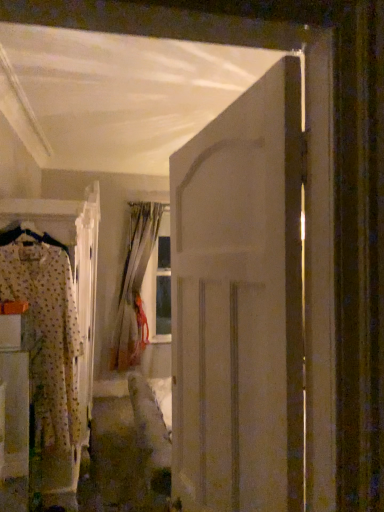
At what (x,y) coordinates should I click in order to perform the action: click on silky beige curtain at center. Please return your answer as a coordinate pair (x, y). Image resolution: width=384 pixels, height=512 pixels. Looking at the image, I should click on (x=134, y=287).

What do you see at coordinates (48, 348) in the screenshot? The image size is (384, 512). I see `patterned fabric pajamas at left` at bounding box center [48, 348].

Where is `fluffy fabric pajama set at left`? This screenshot has width=384, height=512. fluffy fabric pajama set at left is located at coordinates (14, 415).

Identify the location of silky beige curtain at center. click(134, 287).

From the image's perspective, who appears lower, patterned fabric pajamas at left or silky beige curtain at center?

patterned fabric pajamas at left is shown below in the image.

Considering the relative sizes of patterned fabric pajamas at left and silky beige curtain at center in the image provided, is patterned fabric pajamas at left taller than silky beige curtain at center?

No, patterned fabric pajamas at left is not taller than silky beige curtain at center.

From a real-world perspective, does patterned fabric pajamas at left stand above silky beige curtain at center?

No, from a real-world perspective, patterned fabric pajamas at left is not on top of silky beige curtain at center.

Is silky beige curtain at center a part of patterned fabric pajamas at left?

No, silky beige curtain at center is located outside of patterned fabric pajamas at left.

What's the angular difference between white matte door at center and fluffy fabric pajama set at left's facing directions?

They differ by 173 degrees in their facing directions.

Is white matte door at center further to the viewer compared to fluffy fabric pajama set at left?

No, it is in front of fluffy fabric pajama set at left.

From a real-world perspective, between white matte door at center and fluffy fabric pajama set at left, who is vertically higher?

In real-world perspective, white matte door at center is above.

Does white matte door at center have a smaller size compared to fluffy fabric pajama set at left?

Yes, white matte door at center is smaller than fluffy fabric pajama set at left.

Between silky beige curtain at center and patterned fabric pajamas at left, which one appears on the left side from the viewer's perspective?

patterned fabric pajamas at left is more to the left.

Does silky beige curtain at center turn towards patterned fabric pajamas at left?

Yes, silky beige curtain at center is turned towards patterned fabric pajamas at left.

The width and height of the screenshot is (384, 512). Identify the location of clothing that appears below the silky beige curtain at center (from the image's perspective). (48, 348).

Is point (148, 231) positioned after point (51, 291)?

That is True.

Is fluffy fabric pajama set at left next to white matte door at center?

No, fluffy fabric pajama set at left is not in contact with white matte door at center.

From their relative heights in the image, would you say fluffy fabric pajama set at left is taller or shorter than white matte door at center?

In the image, fluffy fabric pajama set at left appears to be shorter than white matte door at center.

Considering the positions of point (11, 361) and point (280, 286), is point (11, 361) closer or farther from the camera than point (280, 286)?

Clearly, point (11, 361) is more distant from the camera than point (280, 286).

Locate an element on the screen. furniture located below the white matte door at center (from the image's perspective) is located at coordinates (14, 415).

Looking at this image, is white matte door at center taller or shorter than patterned fabric pajamas at left?

Clearly, white matte door at center is shorter compared to patterned fabric pajamas at left.

From a real-world perspective, which object stands above the other?

In real-world perspective, white matte door at center is above.

From the image's perspective, is white matte door at center beneath patterned fabric pajamas at left?

Actually, white matte door at center appears above patterned fabric pajamas at left in the image.

Which is in front, point (223, 382) or point (48, 441)?

The point (223, 382) is more forward.

Is silky beige curtain at center beside fluffy fabric pajama set at left?

No, silky beige curtain at center is not beside fluffy fabric pajama set at left.

Can you confirm if silky beige curtain at center is smaller than fluffy fabric pajama set at left?

Incorrect, silky beige curtain at center is not smaller in size than fluffy fabric pajama set at left.

Between silky beige curtain at center and fluffy fabric pajama set at left, which one has more height?

silky beige curtain at center.

Between fluffy fabric pajama set at left and patterned fabric pajamas at left, which one has larger width?

fluffy fabric pajama set at left is wider.

From the picture: Is fluffy fabric pajama set at left outside of patterned fabric pajamas at left?

fluffy fabric pajama set at left lies outside patterned fabric pajamas at left's area.

Considering the relative sizes of fluffy fabric pajama set at left and patterned fabric pajamas at left in the image provided, is fluffy fabric pajama set at left bigger than patterned fabric pajamas at left?

Yes.

I want to click on clothing on the right of fluffy fabric pajama set at left, so click(48, 348).

Locate an element on the screen. This screenshot has height=512, width=384. curtain behind the patterned fabric pajamas at left is located at coordinates (134, 287).

Identify the location of door lying on the right of fluffy fabric pajama set at left. click(x=239, y=304).

Based on their spatial positions, is silky beige curtain at center or patterned fabric pajamas at left further from white matte door at center?

silky beige curtain at center is positioned further to the anchor white matte door at center.

When comparing their distances from patterned fabric pajamas at left, does white matte door at center or fluffy fabric pajama set at left seem further?

white matte door at center lies further to patterned fabric pajamas at left than the other object.

Which object lies nearer to the anchor point fluffy fabric pajama set at left, white matte door at center or patterned fabric pajamas at left?

A: Based on the image, patterned fabric pajamas at left appears to be nearer to fluffy fabric pajama set at left.

Which object lies further to the anchor point fluffy fabric pajama set at left, silky beige curtain at center or patterned fabric pajamas at left?

silky beige curtain at center.

Which object lies further to the anchor point silky beige curtain at center, fluffy fabric pajama set at left or patterned fabric pajamas at left?

patterned fabric pajamas at left.

Estimate the real-world distances between objects in this image. Which object is further from patterned fabric pajamas at left, fluffy fabric pajama set at left or white matte door at center?

Among the two, white matte door at center is located further to patterned fabric pajamas at left.

Which object lies nearer to the anchor point silky beige curtain at center, white matte door at center or fluffy fabric pajama set at left?

fluffy fabric pajama set at left is closer to silky beige curtain at center.

Considering their positions, is fluffy fabric pajama set at left positioned further to white matte door at center than silky beige curtain at center?

silky beige curtain at center lies further to white matte door at center than the other object.

The image size is (384, 512). What are the coordinates of `clothing between fluffy fabric pajama set at left and silky beige curtain at center in the front-back direction` in the screenshot? It's located at (48, 348).

Identify the location of furniture between white matte door at center and silky beige curtain at center along the z-axis. This screenshot has height=512, width=384. (14, 415).

Identify the location of clothing between white matte door at center and silky beige curtain at center from front to back. This screenshot has width=384, height=512. (48, 348).

Where is `furniture between white matte door at center and patterned fabric pajamas at left in the front-back direction`? furniture between white matte door at center and patterned fabric pajamas at left in the front-back direction is located at coordinates (14, 415).